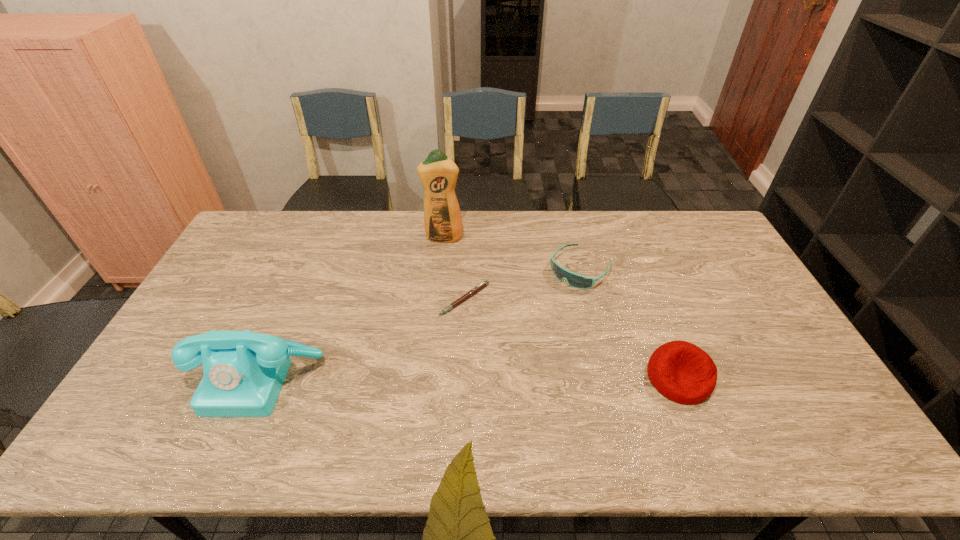
You are a GUI agent. You are given a task and a screenshot of the screen. Output one action in this format:
    pyautogui.click(x=<x>, y=<y>)
    Task: Click on the second tallest object
    The height and width of the screenshot is (540, 960).
    Given the screenshot: What is the action you would take?
    pyautogui.click(x=243, y=372)

The height and width of the screenshot is (540, 960). I want to click on telephone, so click(x=243, y=372).

Find the location of a particular element. The width and height of the screenshot is (960, 540). the third tallest object is located at coordinates (682, 372).

The height and width of the screenshot is (540, 960). I want to click on beanbag, so click(x=682, y=372).

Where is `pen`? pen is located at coordinates (476, 289).

At what (x,y) coordinates should I click in order to perform the action: click on sunglasses. Please return your answer as a coordinate pair (x, y). The height and width of the screenshot is (540, 960). Looking at the image, I should click on (578, 281).

What are the coordinates of `the second object from right to left` in the screenshot? It's located at (578, 281).

Image resolution: width=960 pixels, height=540 pixels. I want to click on the farthest object, so 438,173.

Find the location of a particular element. The height and width of the screenshot is (540, 960). detergent is located at coordinates (438, 173).

I want to click on free space located 0.110m at the nib of the shortest object, so click(x=476, y=346).